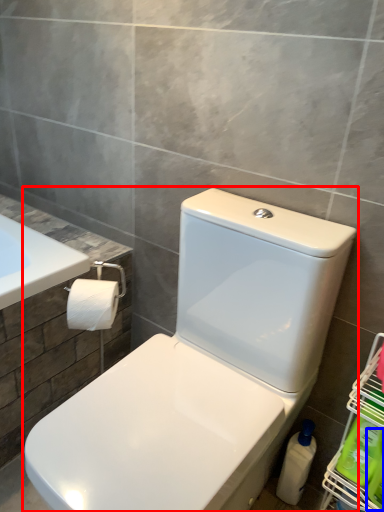
Question: Among these objects, which one is farthest to the camera, toilet (highlighted by a red box) or cleaning product (highlighted by a blue box)?

Choices:
 (A) toilet
 (B) cleaning product

Answer: (B)